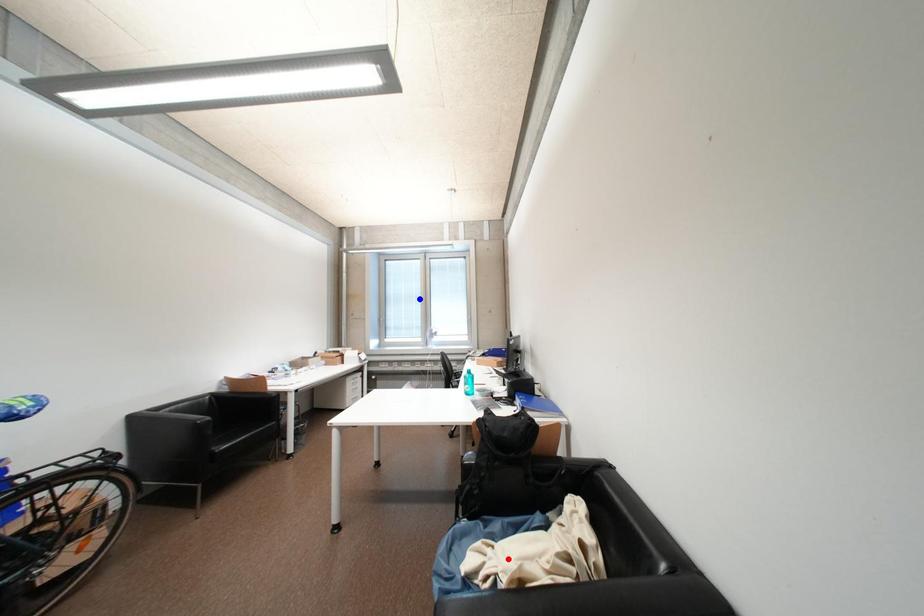
Question: In the image, two points are highlighted. Which point is nearer to the camera? Reply with the corresponding letter.

Choices:
 (A) blue point
 (B) red point

Answer: (B)